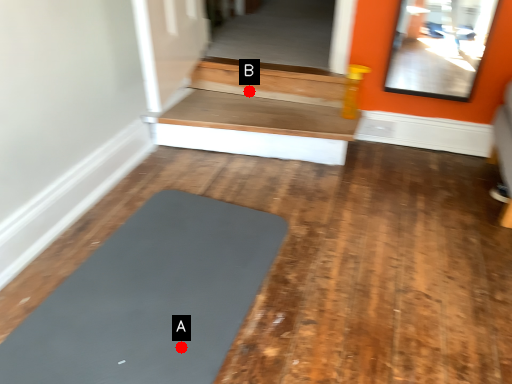
Question: Two points are circled on the image, labeled by A and B beside each circle. Which point is farther to the camera?

Choices:
 (A) A is further
 (B) B is further

Answer: (B)